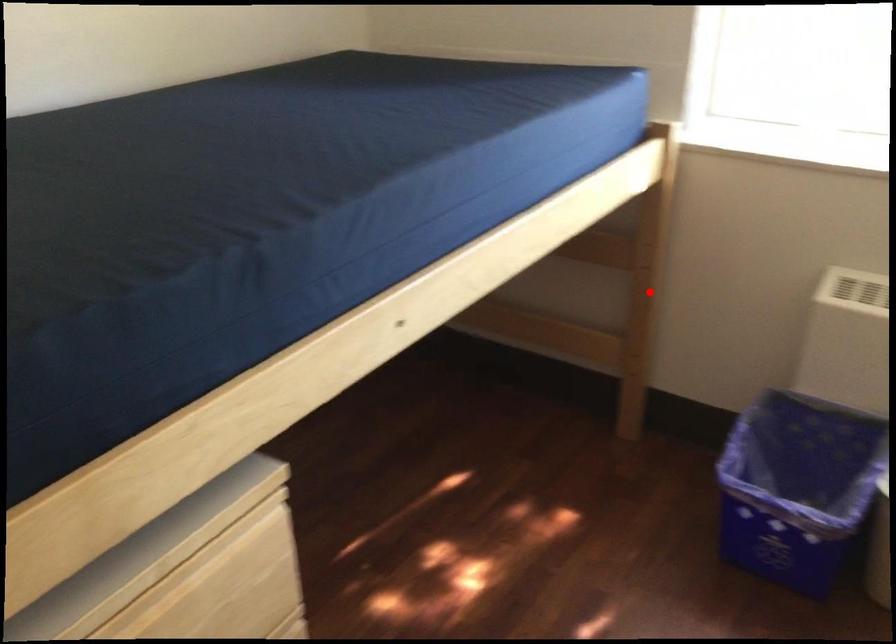
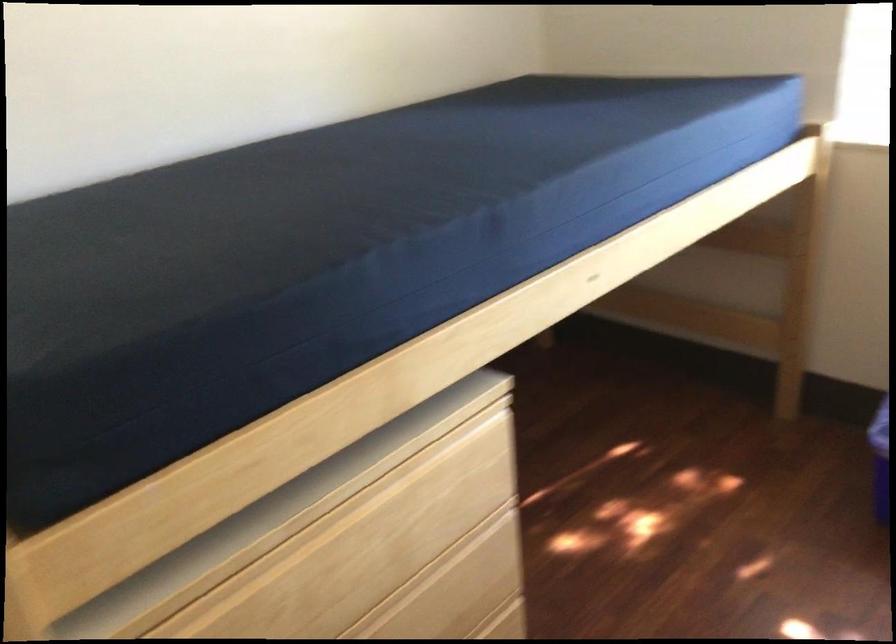
Question: I am providing you with two images of the same scene from different viewpoints. Image1 has a red point marked. In image2, the corresponding 3D location appears at what relative position? Reply with the corresponding letter.

Choices:
 (A) Closer
 (B) Farther

Answer: (B)